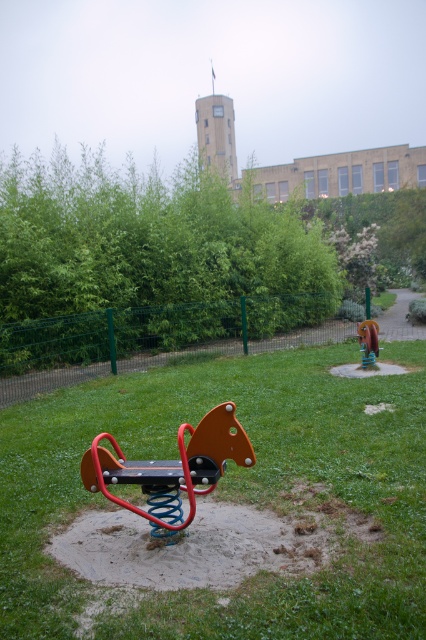
You are a parent trying to find a place to sit while watching your child play on the spring rider. You see the orange matte seesaw at center and the wooden bench at center. Which object is closer to the spring rider?

The orange matte seesaw at center is to the left of the wooden bench at center, so the orange matte seesaw at center is closer to the spring rider as it is positioned to the left side of the wooden bench at center.

You are standing at the point marked by the coordinates point (232, 493) in the playground scene. What is the immediate surface you are standing on?

The point (232, 493) marks green grassy at center, so you are standing on green grassy at center.

You are a parent trying to find a spot to sit while watching your child play on the spring rider. You see the green grassy at center and the wooden bench at center. Which one is to the left of the other?

The green grassy at center is positioned on the left side of wooden bench at center.